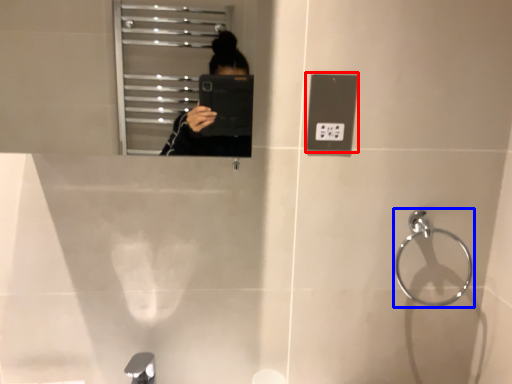
Question: Which object appears closest to the camera in this image, light switch (highlighted by a red box) or towel bar (highlighted by a blue box)?

Choices:
 (A) light switch
 (B) towel bar

Answer: (A)